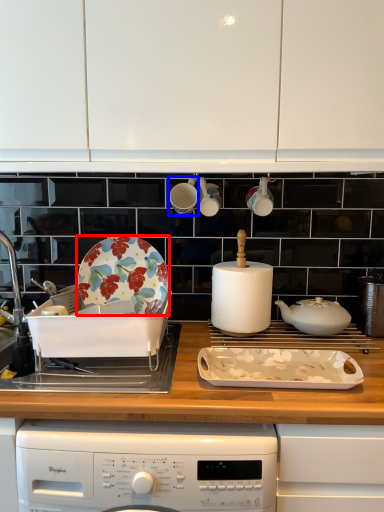
Question: Which object is further to the camera taking this photo, plate (highlighted by a red box) or appliance (highlighted by a blue box)?

Choices:
 (A) plate
 (B) appliance

Answer: (B)